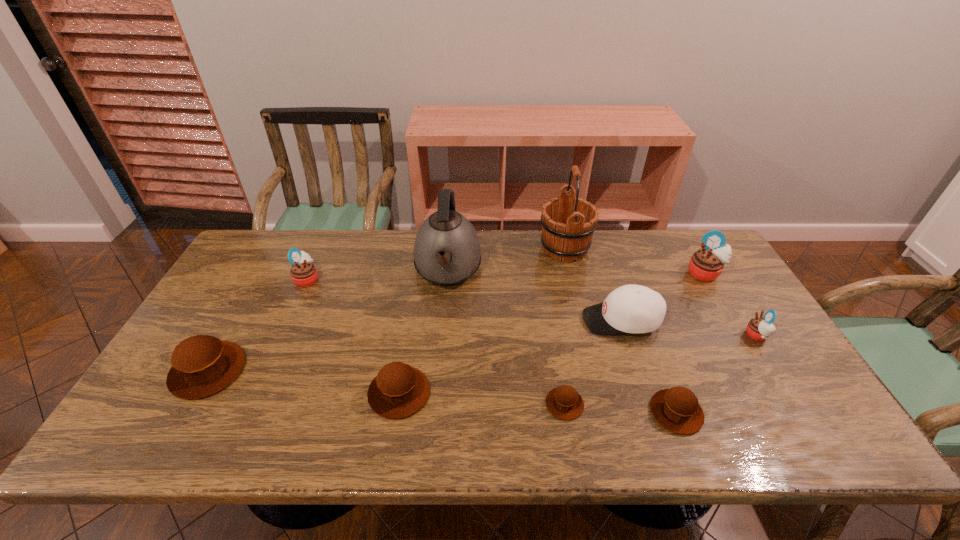
You are a GUI agent. You are given a task and a screenshot of the screen. Output one action in this format:
    pyautogui.click(x=<x>, y=<y>)
    Task: Click on the object that is the eighth closest to the ninth object from right to left
    The width and height of the screenshot is (960, 540).
    Given the screenshot: What is the action you would take?
    pyautogui.click(x=706, y=264)

The image size is (960, 540). Find the location of `object that stands as the third closest to the wine bucket`. object that stands as the third closest to the wine bucket is located at coordinates (706, 264).

Locate an element on the screen. The width and height of the screenshot is (960, 540). muffin that can be found as the sixth closest to the leftmost muffin is located at coordinates (x=759, y=329).

What are the coordinates of `muffin that can be found as the fifth closest to the gray kettle` in the screenshot? It's located at (677, 409).

Image resolution: width=960 pixels, height=540 pixels. I want to click on pink muffin that is the second closest to the ninth object from right to left, so click(759, 329).

Identify which pink muffin is located as the third nearest to the wood wine bucket. Please provide its 2D coordinates. Your answer should be formatted as a tuple, i.e. [(x, y)], where the tuple contains the x and y coordinates of a point satisfying the conditions above.

[(303, 272)]

The image size is (960, 540). I want to click on brown muffin that is the second closest to the second smallest pink muffin, so click(x=398, y=391).

The height and width of the screenshot is (540, 960). In order to click on brown muffin that can be found as the third closest to the third smallest brown muffin in this screenshot , I will do `click(677, 409)`.